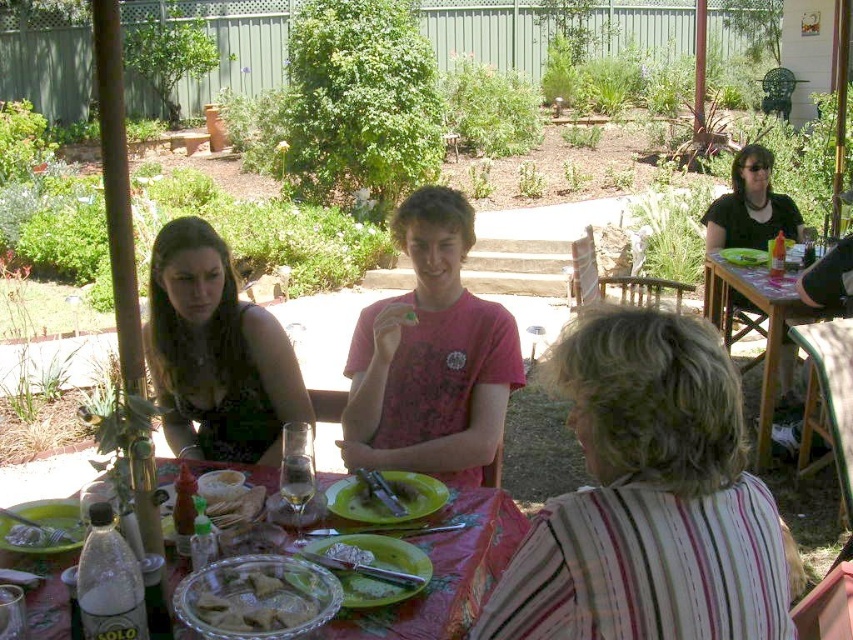
Is white striped shirt at lower right closer to the viewer compared to golden brown pastry at center?

Yes, white striped shirt at lower right is in front of golden brown pastry at center.

Image resolution: width=853 pixels, height=640 pixels. What are the coordinates of `white striped shirt at lower right` in the screenshot? It's located at (648, 499).

Which is more to the right, translucent glass plate at lower center or matte black shirt at upper right?

matte black shirt at upper right

Does translucent glass plate at lower center have a larger size compared to matte black shirt at upper right?

No, translucent glass plate at lower center is not bigger than matte black shirt at upper right.

Is point (492, 573) closer to camera compared to point (733, 192)?

Yes.

The image size is (853, 640). I want to click on translucent glass plate at lower center, so click(x=448, y=572).

Based on the photo, can you confirm if wooden table at upper right is positioned above green leafy salad at center?

Yes, wooden table at upper right is above green leafy salad at center.

Describe the element at coordinates (767, 323) in the screenshot. I see `wooden table at upper right` at that location.

Based on the photo, who is more forward, (778, 298) or (383, 480)?

Point (383, 480)

You are a GUI agent. You are given a task and a screenshot of the screen. Output one action in this format:
    pyautogui.click(x=<x>, y=<y>)
    Task: Click on the wooden table at upper right
    Image resolution: width=853 pixels, height=640 pixels.
    Given the screenshot: What is the action you would take?
    pyautogui.click(x=767, y=323)